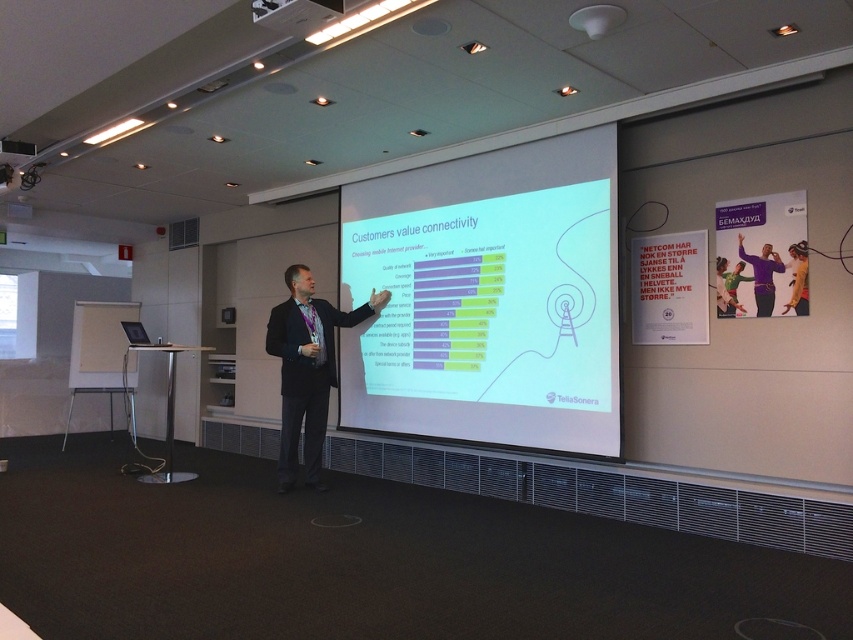
Who is positioned more to the left, matte white projector screen at center or black suit at center?

Positioned to the left is black suit at center.

Can you confirm if matte white projector screen at center is thinner than black suit at center?

→ In fact, matte white projector screen at center might be wider than black suit at center.

Locate an element on the screen. Image resolution: width=853 pixels, height=640 pixels. matte white projector screen at center is located at coordinates (488, 298).

The height and width of the screenshot is (640, 853). Identify the location of matte white projector screen at center. (488, 298).

Is black suit at center to the right of white plastic projector at upper center from the viewer's perspective?

In fact, black suit at center is to the left of white plastic projector at upper center.

Can you confirm if black suit at center is shorter than white plastic projector at upper center?

No, black suit at center is not shorter than white plastic projector at upper center.

You are a GUI agent. You are given a task and a screenshot of the screen. Output one action in this format:
    pyautogui.click(x=<x>, y=<y>)
    Task: Click on the black suit at center
    This screenshot has width=853, height=640.
    Given the screenshot: What is the action you would take?
    pyautogui.click(x=306, y=369)

The height and width of the screenshot is (640, 853). What do you see at coordinates (488, 298) in the screenshot? I see `matte white projector screen at center` at bounding box center [488, 298].

Is matte white projector screen at center to the left of white plastic projector at upper center from the viewer's perspective?

No, matte white projector screen at center is not to the left of white plastic projector at upper center.

Is point (440, 186) more distant than point (340, 4)?

That is True.

This screenshot has width=853, height=640. What are the coordinates of `matte white projector screen at center` in the screenshot? It's located at (488, 298).